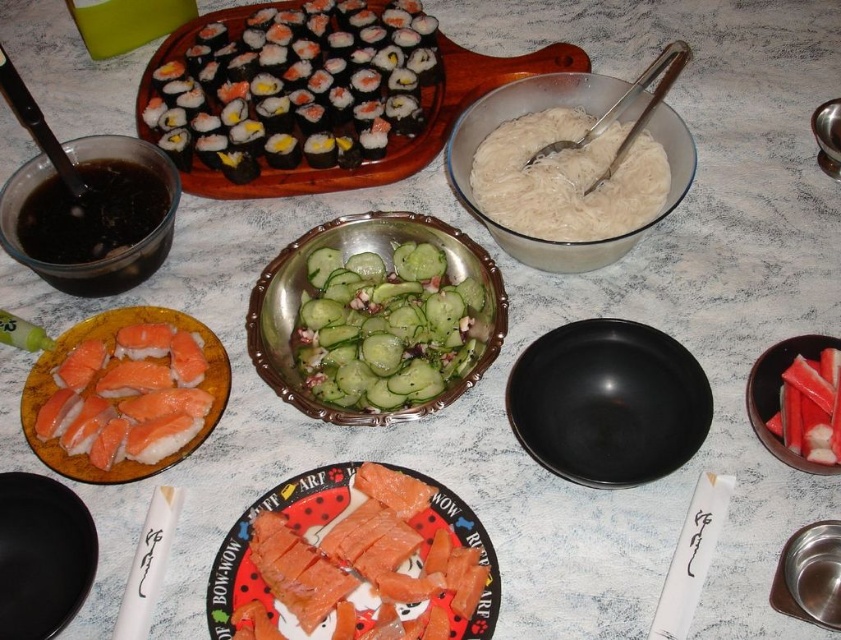
Is pinkish salmon at center wider than black matte bowl at center?

Yes.

Which is more to the left, pinkish salmon at center or black matte bowl at center?

From the viewer's perspective, pinkish salmon at center appears more on the left side.

Is point (334, 602) positioned behind point (516, 387)?

No, (334, 602) is closer to viewer.

Image resolution: width=841 pixels, height=640 pixels. I want to click on pinkish salmon at center, so click(353, 560).

Based on the photo, can you confirm if pinkish salmon at center is wider than shiny dark brown bowl at upper left?

Indeed, pinkish salmon at center has a greater width compared to shiny dark brown bowl at upper left.

Where is `pinkish salmon at center`? The width and height of the screenshot is (841, 640). pinkish salmon at center is located at coordinates (353, 560).

Based on the photo, who is higher up, shiny dark brown bowl at upper left or brushed metal bowl at lower right?

shiny dark brown bowl at upper left is higher up.

The height and width of the screenshot is (640, 841). What do you see at coordinates (98, 259) in the screenshot? I see `shiny dark brown bowl at upper left` at bounding box center [98, 259].

Between point (46, 173) and point (802, 538), which one is positioned behind?

The point (46, 173) is behind.

Locate an element on the screen. The width and height of the screenshot is (841, 640). shiny dark brown bowl at upper left is located at coordinates click(x=98, y=259).